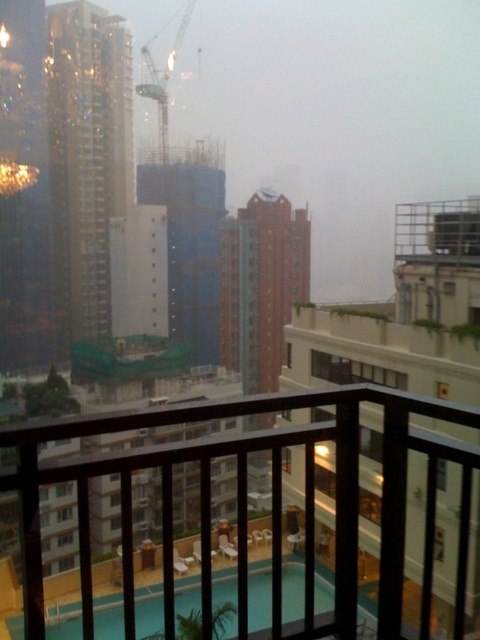
Question: Which object is positioned closest to the metallic blue crane at upper center?

Choices:
 (A) metal mesh balcony at upper right
 (B) shiny gold skyscraper at left
 (C) clear glass pool at center

Answer: (B)

Question: Can you confirm if white concrete building at center is smaller than clear glass pool at center?

Choices:
 (A) yes
 (B) no

Answer: (B)

Question: Which of the following is the farthest from the observer?

Choices:
 (A) clear glass pool at center
 (B) white concrete building at center
 (C) metal mesh balcony at upper right
 (D) shiny gold skyscraper at left

Answer: (D)

Question: Is black wooden railing at center to the right of metallic blue crane at upper center from the viewer's perspective?

Choices:
 (A) no
 (B) yes

Answer: (B)

Question: Based on their relative distances, which object is farther from the black wooden railing at center?

Choices:
 (A) white concrete building at center
 (B) metallic blue crane at upper center
 (C) clear glass pool at center

Answer: (B)

Question: Can you confirm if white concrete building at center is positioned to the left of clear glass pool at center?

Choices:
 (A) yes
 (B) no

Answer: (B)